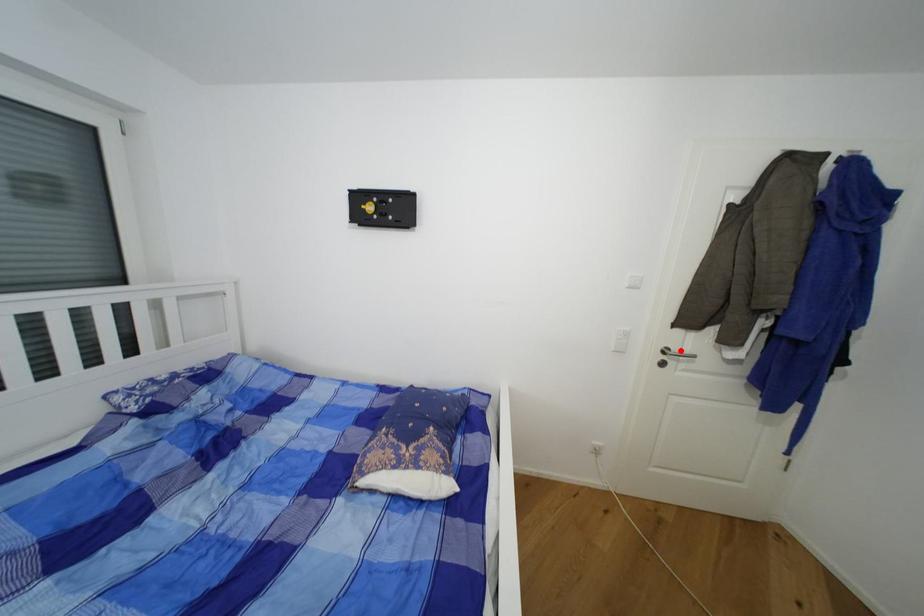
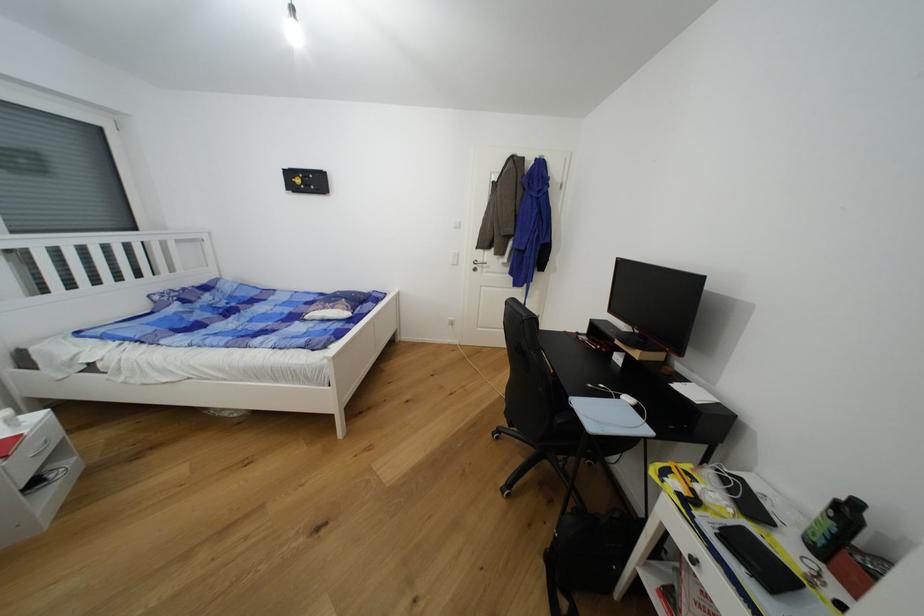
Find the pixel in the second image that matches the highlighted location in the first image.

(484, 262)